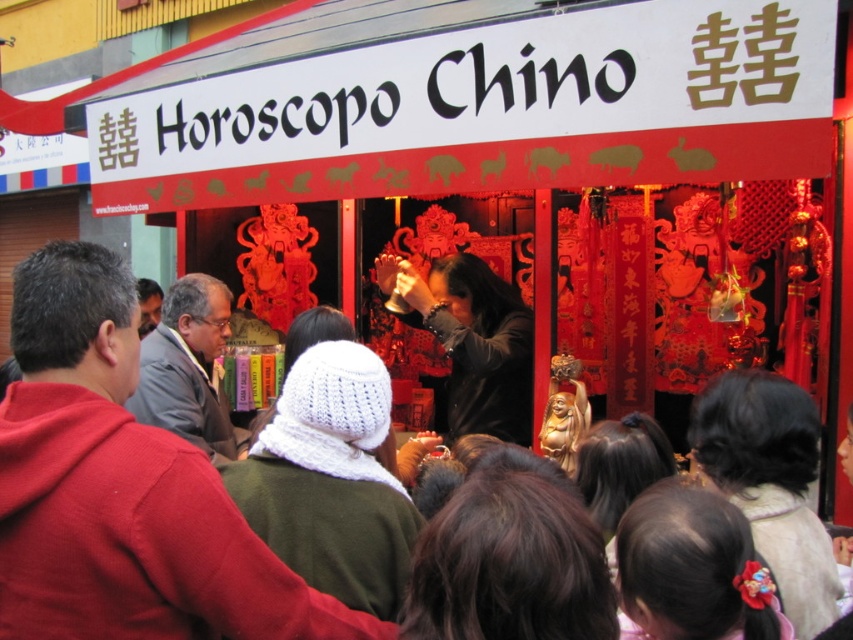
Can you confirm if dark brown leather jacket at center is wider than gray fabric jacket at center?

Correct, the width of dark brown leather jacket at center exceeds that of gray fabric jacket at center.

Between dark brown leather jacket at center and gray fabric jacket at center, which one is positioned higher?

dark brown leather jacket at center is above.

The height and width of the screenshot is (640, 853). What are the coordinates of `dark brown leather jacket at center` in the screenshot? It's located at (473, 340).

The width and height of the screenshot is (853, 640). In order to click on dark brown leather jacket at center in this screenshot , I will do `click(473, 340)`.